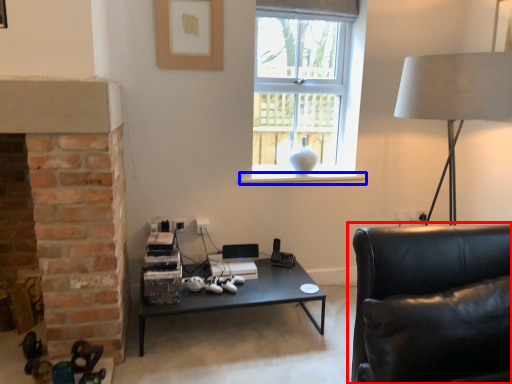
Question: Which of the following is the closest to the observer, studio couch (highlighted by a red box) or window sill (highlighted by a blue box)?

Choices:
 (A) studio couch
 (B) window sill

Answer: (A)